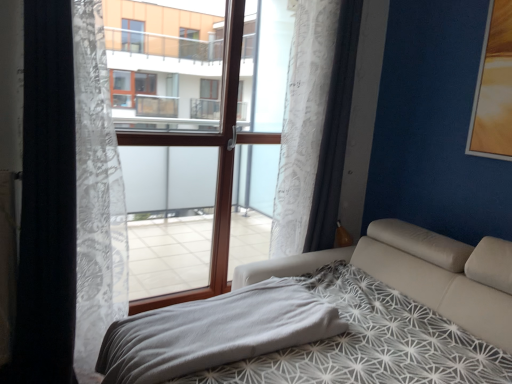
Question: Considering the relative sizes of white lace curtain at center, arranged as the 3th curtain when viewed from the left, and brown wood window frame at center in the image provided, is white lace curtain at center, arranged as the 3th curtain when viewed from the left, shorter than brown wood window frame at center?

Choices:
 (A) no
 (B) yes

Answer: (B)

Question: Can you confirm if white lace curtain at center, arranged as the 3th curtain when viewed from the left, is wider than brown wood window frame at center?

Choices:
 (A) yes
 (B) no

Answer: (A)

Question: From a real-world perspective, is white lace curtain at center, the 1th curtain viewed from the right, on brown wood window frame at center?

Choices:
 (A) yes
 (B) no

Answer: (A)

Question: Considering the relative positions of white lace curtain at center, arranged as the 3th curtain when viewed from the left, and brown wood window frame at center in the image provided, is white lace curtain at center, arranged as the 3th curtain when viewed from the left, to the right of brown wood window frame at center from the viewer's perspective?

Choices:
 (A) yes
 (B) no

Answer: (A)

Question: Is white lace curtain at center, the 1th curtain viewed from the right, at the left side of brown wood window frame at center?

Choices:
 (A) no
 (B) yes

Answer: (A)

Question: Is brown wood window frame at center at the back of white lace curtain at center, arranged as the 3th curtain when viewed from the left?

Choices:
 (A) no
 (B) yes

Answer: (A)

Question: Is white lace curtain at center, arranged as the 3th curtain when viewed from the left, shorter than white lace curtain at left, which ranks as the second curtain in right-to-left order?

Choices:
 (A) yes
 (B) no

Answer: (A)

Question: Considering the relative positions of white lace curtain at center, arranged as the 3th curtain when viewed from the left, and white lace curtain at left, marked as the 2th curtain in a left-to-right arrangement, in the image provided, is white lace curtain at center, arranged as the 3th curtain when viewed from the left, to the right of white lace curtain at left, marked as the 2th curtain in a left-to-right arrangement, from the viewer's perspective?

Choices:
 (A) no
 (B) yes

Answer: (B)

Question: Is white lace curtain at center, arranged as the 3th curtain when viewed from the left, aimed at white lace curtain at left, marked as the 2th curtain in a left-to-right arrangement?

Choices:
 (A) yes
 (B) no

Answer: (B)

Question: Is white lace curtain at center, arranged as the 3th curtain when viewed from the left, thinner than white lace curtain at left, which ranks as the second curtain in right-to-left order?

Choices:
 (A) no
 (B) yes

Answer: (A)

Question: Is white lace curtain at left, which ranks as the second curtain in right-to-left order, surrounded by white lace curtain at center, the 1th curtain viewed from the right?

Choices:
 (A) yes
 (B) no

Answer: (B)

Question: Is white lace curtain at center, arranged as the 3th curtain when viewed from the left, further to the viewer compared to white lace curtain at left, which ranks as the second curtain in right-to-left order?

Choices:
 (A) yes
 (B) no

Answer: (A)

Question: Is gray soft blanket at lower center positioned far away from white sheer curtain at left, which ranks as the 3th curtain in right-to-left order?

Choices:
 (A) no
 (B) yes

Answer: (A)